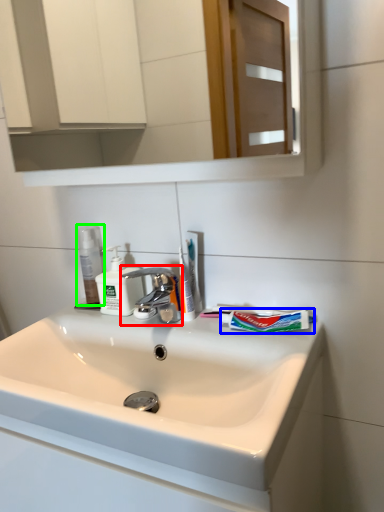
Question: Which object is the farthest from tap (highlighted by a red box)? Choose among these: toothpaste (highlighted by a blue box) or mouthwash (highlighted by a green box).

Choices:
 (A) toothpaste
 (B) mouthwash

Answer: (A)